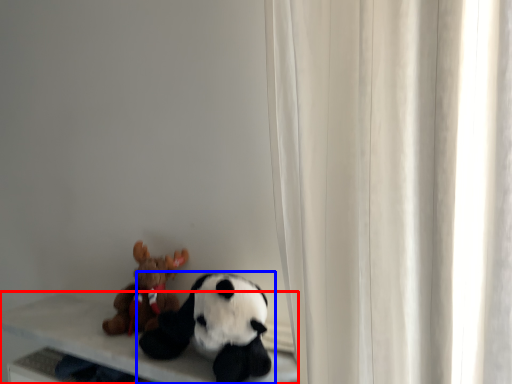
Question: Which object is further to the camera taking this photo, table (highlighted by a red box) or toy (highlighted by a blue box)?

Choices:
 (A) table
 (B) toy

Answer: (A)